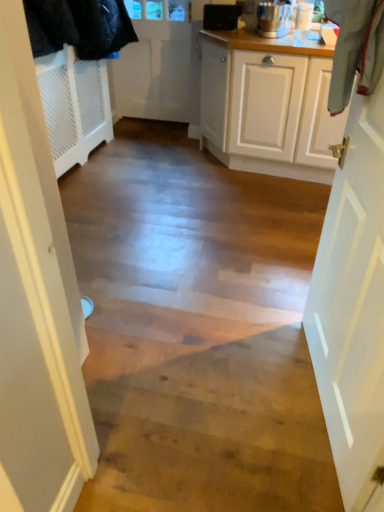
Question: Relative to white matte door at right, placed as the first door when sorted from right to left, is white matte door at upper center, the second door from the front, in front or behind?

Choices:
 (A) behind
 (B) front

Answer: (A)

Question: Is point (142, 38) closer or farther from the camera than point (372, 402)?

Choices:
 (A) farther
 (B) closer

Answer: (A)

Question: Which is nearer to the polished stainless steel blender at upper right?

Choices:
 (A) white matte door at right, which is counted as the 1th door, starting from the front
 (B) white matte door at upper center, the second door from the front
 (C) black plastic speaker at upper center

Answer: (C)

Question: Estimate the real-world distances between objects in this image. Which object is farther from the white matte door at right, which is the second door from left to right?

Choices:
 (A) white matte door at upper center, marked as the 1th door in a top-to-bottom arrangement
 (B) black plastic speaker at upper center
 (C) polished stainless steel blender at upper right

Answer: (A)